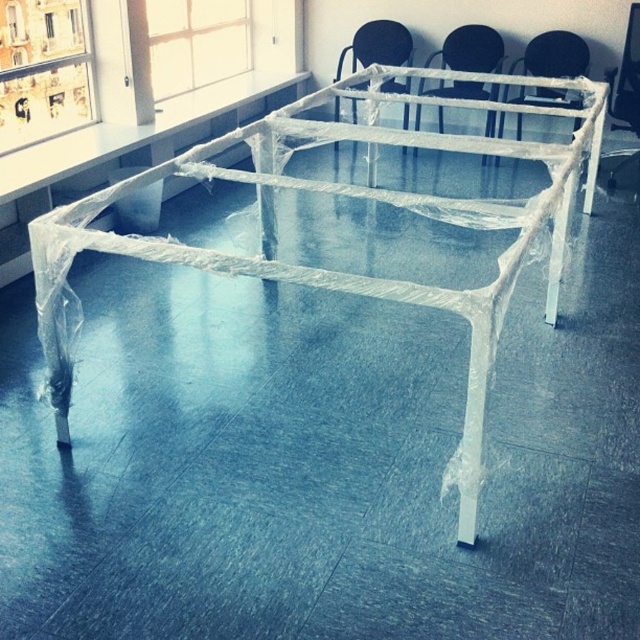
Can you confirm if clear plastic chair at upper center is wider than clear plastic chair at center?

Correct, the width of clear plastic chair at upper center exceeds that of clear plastic chair at center.

Is clear plastic chair at upper center positioned at the back of clear plastic chair at center?

No, it is not.

Between point (484, 54) and point (356, 35), which one is positioned in front?

Point (484, 54) is in front.

Where is `clear plastic chair at upper center`? The width and height of the screenshot is (640, 640). clear plastic chair at upper center is located at coordinates (470, 49).

Between transparent plastic bed frame at center and clear plastic chair at upper center, which one appears on the left side from the viewer's perspective?

transparent plastic bed frame at center

Is point (125, 193) positioned after point (465, 56)?

No, it is not.

Locate an element on the screen. The image size is (640, 640). transparent plastic bed frame at center is located at coordinates (349, 196).

Can you confirm if transparent plastic chair at upper center is shorter than clear plastic chair at center?

Indeed, transparent plastic chair at upper center has a lesser height compared to clear plastic chair at center.

Which is above, transparent plastic chair at upper center or clear plastic chair at center?

clear plastic chair at center

Between point (502, 93) and point (388, 49), which one is positioned in front?

Point (388, 49) is more forward.

The width and height of the screenshot is (640, 640). In order to click on transparent plastic chair at upper center in this screenshot , I will do `click(554, 54)`.